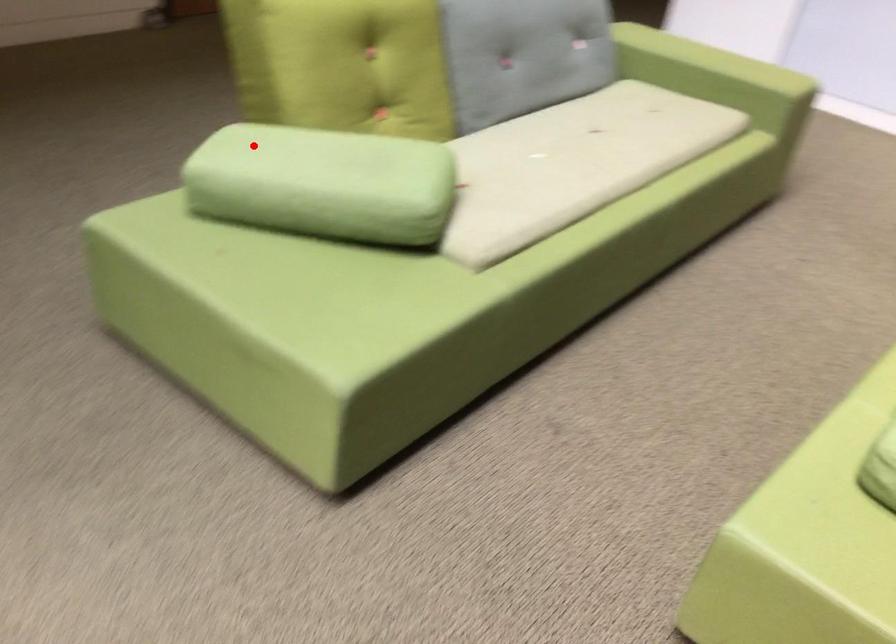
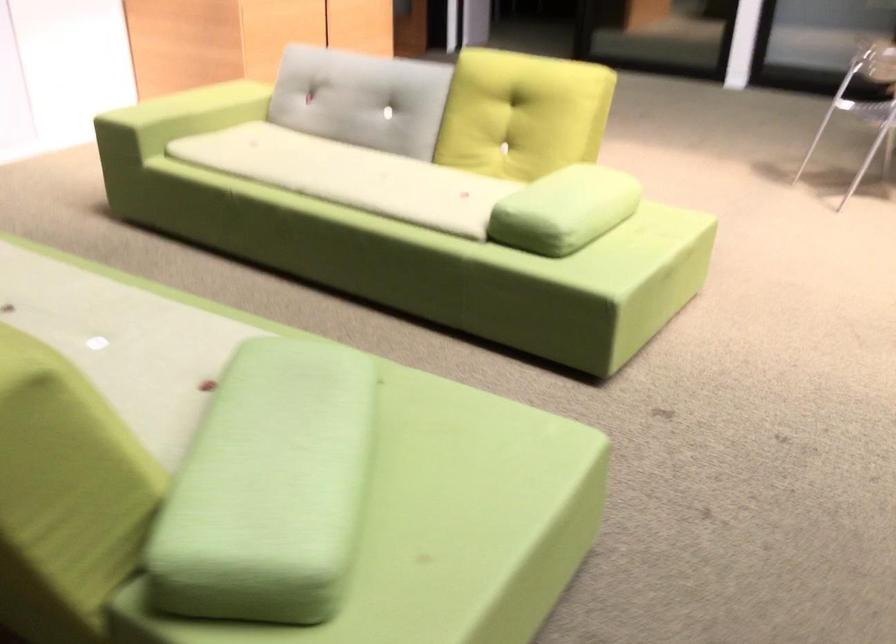
Locate, in the second image, the point that corresponds to the highlighted location in the first image.

(269, 488)